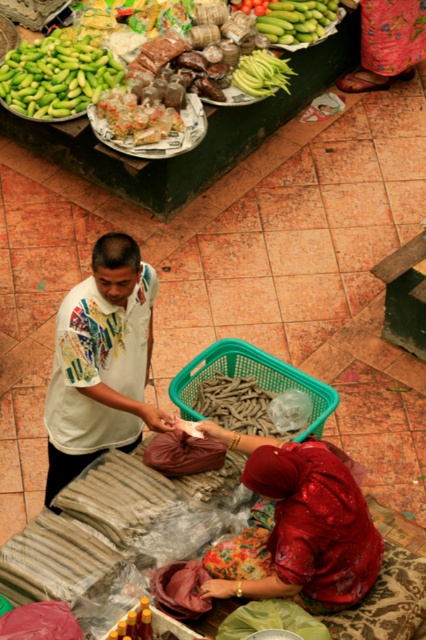
Question: Which is nearer to the floral fabric skirt at lower right?

Choices:
 (A) green matte beans at upper center
 (B) shiny red fabric at center
 (C) green matte cucumber at upper center
 (D) green matte beans at upper left

Answer: (C)

Question: Among these objects, which one is nearest to the camera?

Choices:
 (A) green matte beans at upper left
 (B) green matte beans at upper center

Answer: (A)

Question: Is green matte beans at upper left smaller than floral fabric skirt at lower right?

Choices:
 (A) yes
 (B) no

Answer: (B)

Question: Which object is positioned closest to the green matte beans at upper left?

Choices:
 (A) floral fabric skirt at lower right
 (B) white printed shirt at center
 (C) green matte beans at upper center
 (D) shiny red fabric at center

Answer: (C)

Question: In this image, where is shiny red fabric at center located relative to floral fabric skirt at lower right?

Choices:
 (A) right
 (B) left

Answer: (B)

Question: In this image, where is shiny red fabric at center located relative to green matte beans at upper center?

Choices:
 (A) below
 (B) above

Answer: (A)